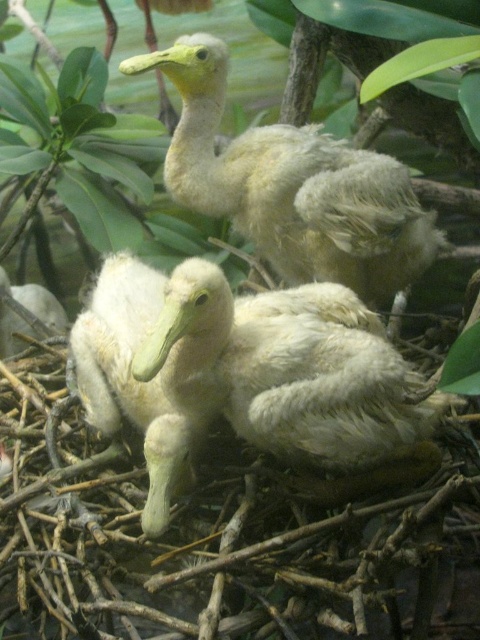
Question: Which of these objects is positioned closest to the white fluffy duckling at left?

Choices:
 (A) white fluffy duck at center
 (B) soft yellow duckling at center
 (C) white fluffy duckling at center

Answer: (C)

Question: Which of the following is the closest to the observer?

Choices:
 (A) (348, 186)
 (B) (162, 394)
 (C) (36, 291)

Answer: (B)

Question: Does white fluffy duckling at center appear over white fluffy duckling at left?

Choices:
 (A) yes
 (B) no

Answer: (B)

Question: Observing the image, what is the correct spatial positioning of white fluffy duckling at center in reference to white fluffy duckling at left?

Choices:
 (A) above
 (B) below

Answer: (B)

Question: Which point is farther from the camera taking this photo?

Choices:
 (A) (149, 516)
 (B) (312, 136)
 (C) (6, 340)

Answer: (C)

Question: Does white fluffy duck at center have a smaller size compared to white fluffy duckling at center?

Choices:
 (A) no
 (B) yes

Answer: (B)